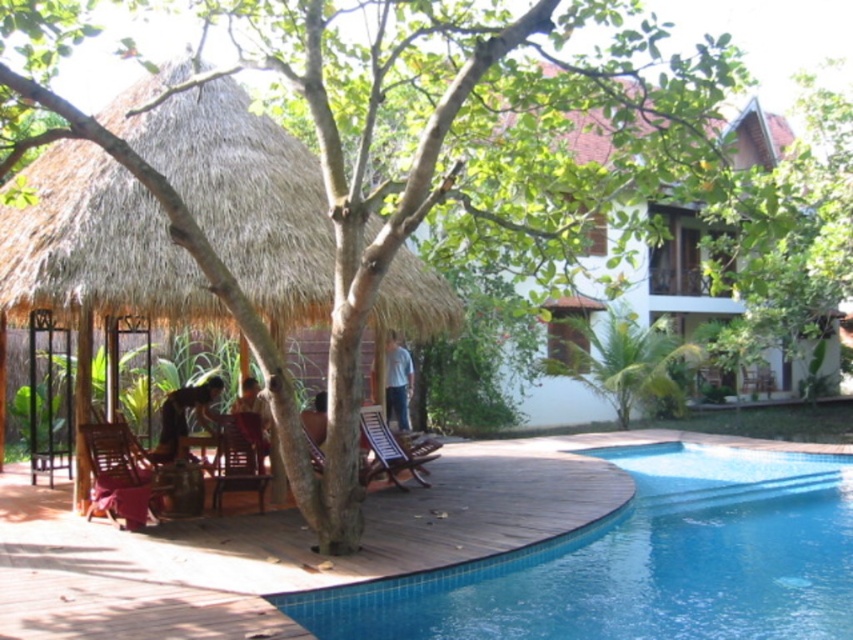
Question: In this image, where is white matte house at upper right located relative to blue jeans at center?

Choices:
 (A) right
 (B) left

Answer: (A)

Question: Considering the real-world distances, which object is closest to the blue jeans at center?

Choices:
 (A) thatched straw hut at left
 (B) wooden chair at lower left
 (C) wooden textured chair at lower center

Answer: (C)

Question: Which object is closer to the camera taking this photo?

Choices:
 (A) blue jeans at center
 (B) smooth brown skin at lower center
 (C) thatched straw hut at left
 (D) blue glossy pool at lower center

Answer: (D)

Question: Can you confirm if wooden chair at lower center is positioned to the left of wooden textured chair at lower center?

Choices:
 (A) yes
 (B) no

Answer: (A)

Question: Considering the relative positions of wooden chair at lower left and wooden textured chair at lower center in the image provided, where is wooden chair at lower left located with respect to wooden textured chair at lower center?

Choices:
 (A) below
 (B) above

Answer: (A)

Question: Which of the following is the closest to the observer?

Choices:
 (A) wooden chair at lower left
 (B) wooden textured chair at lower center
 (C) blue glossy pool at lower center

Answer: (C)